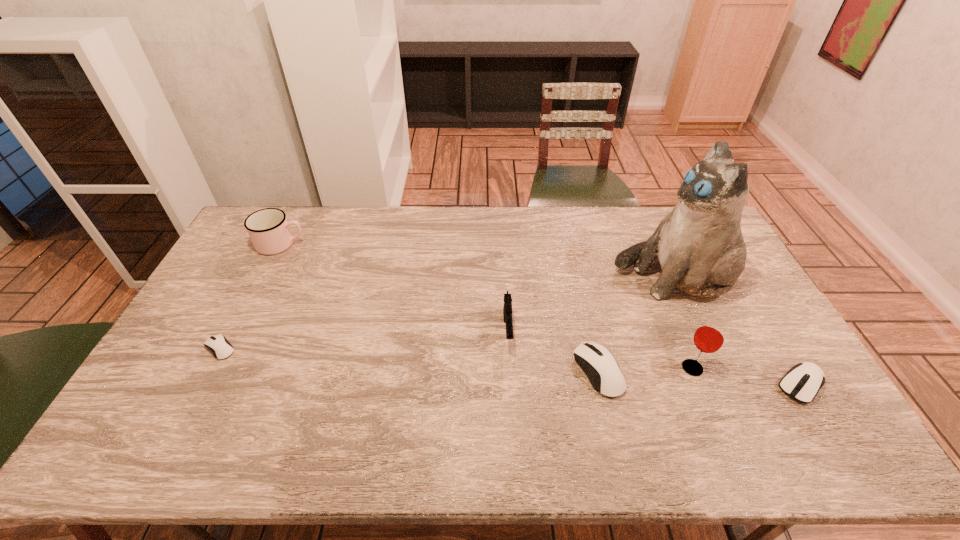
Image resolution: width=960 pixels, height=540 pixels. In order to click on the closest object to the fourth object from left to right in this screenshot , I will do `click(709, 337)`.

In order to click on mouse object that ranks as the closest to the second mouse from left to right in this screenshot , I will do `click(802, 382)`.

You are a GUI agent. You are given a task and a screenshot of the screen. Output one action in this format:
    pyautogui.click(x=<x>, y=<y>)
    Task: Click on the mouse that is the closest one to the mug
    
    Given the screenshot: What is the action you would take?
    pyautogui.click(x=220, y=347)

In order to click on vacant region that satisfies the following two spatial constraints: 1. on the front-facing side of the second mouse from left to right; 2. on the left side of the third object from left to right in this screenshot , I will do `click(510, 372)`.

At what (x,y) coordinates should I click in order to perform the action: click on vacant region that satisfies the following two spatial constraints: 1. at the face of the tallest object; 2. on the front side of the sixth shortest object. Please return your answer as a coordinate pair (x, y). The image size is (960, 540). Looking at the image, I should click on (715, 368).

The image size is (960, 540). In order to click on free location that satisfies the following two spatial constraints: 1. on the front-facing side of the pistol; 2. on the left side of the second shortest object in this screenshot , I will do `click(511, 385)`.

This screenshot has width=960, height=540. What are the coordinates of `vacant space that satisfies the following two spatial constraints: 1. on the side of the mug with the handle; 2. on the back side of the glass` in the screenshot? It's located at (218, 368).

Identify the location of free region that satisfies the following two spatial constraints: 1. on the front-facing side of the glass; 2. on the left side of the pistol. (510, 368).